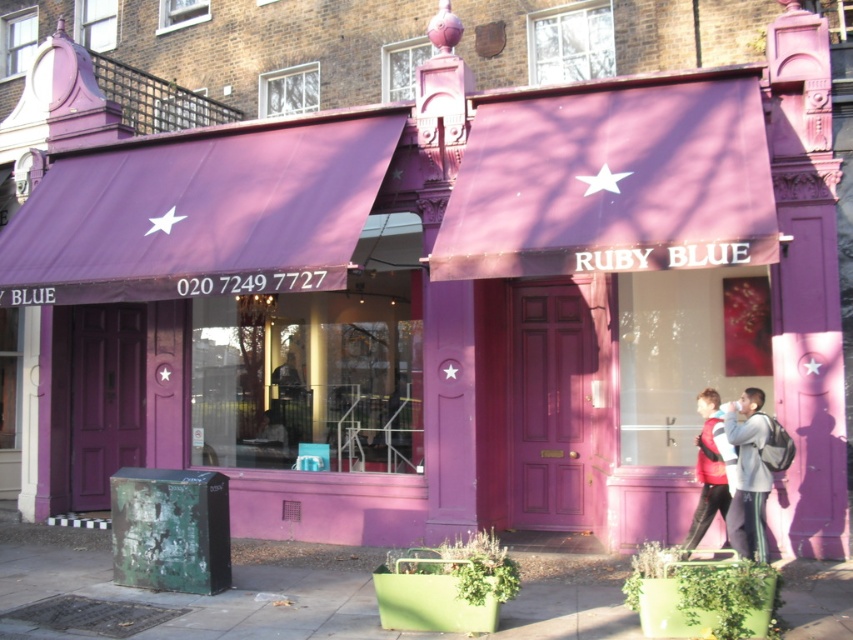
Is point (357, 428) positioned behind point (767, 435)?

Yes, it is.

Who is more forward, (x=271, y=420) or (x=757, y=397)?

Positioned in front is point (x=757, y=397).

The image size is (853, 640). In order to click on transparent glass shop window at center in this screenshot , I will do `click(309, 378)`.

Does red leather jacket at right have a greater width compared to gray fabric jacket at center?

Indeed, red leather jacket at right has a greater width compared to gray fabric jacket at center.

Identify the location of red leather jacket at right. (729, 470).

Between point (9, 595) and point (770, 486), which one is positioned behind?

The point (9, 595) is more distant.

This screenshot has height=640, width=853. Describe the element at coordinates (207, 596) in the screenshot. I see `green metal planters at lower center` at that location.

Locate an element on the screen. This screenshot has height=640, width=853. green metal planters at lower center is located at coordinates (207, 596).